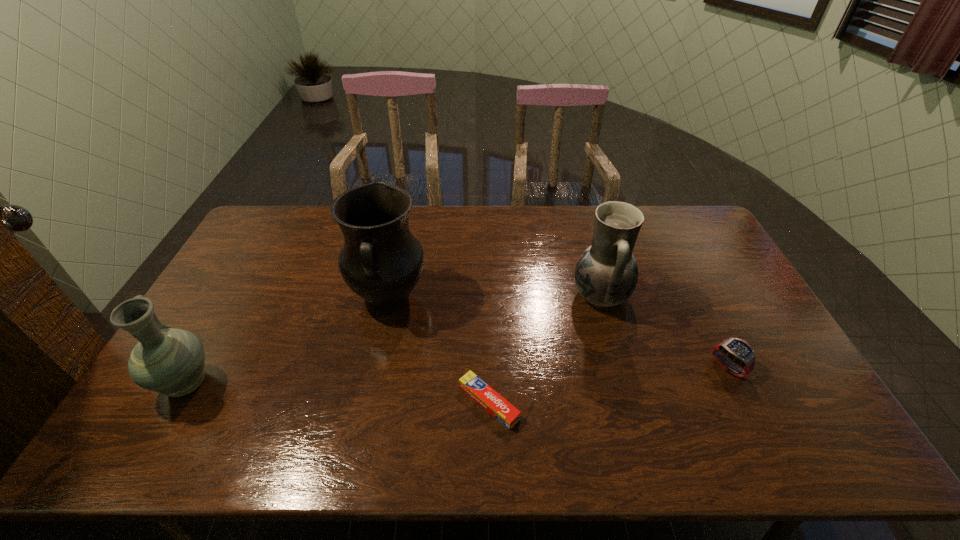
The image size is (960, 540). Find the location of `empty space between the nearest pitcher and the second pitcher from right to left`. empty space between the nearest pitcher and the second pitcher from right to left is located at coordinates (288, 341).

You are a GUI agent. You are given a task and a screenshot of the screen. Output one action in this format:
    pyautogui.click(x=<x>, y=<y>)
    Task: Click on the vacant area between the rightmost object and the fourth object from right to left
    This screenshot has height=540, width=960.
    Given the screenshot: What is the action you would take?
    pyautogui.click(x=558, y=332)

The height and width of the screenshot is (540, 960). I want to click on free area in between the fourth object from right to left and the leftmost pitcher, so click(288, 341).

Locate an element on the screen. vacant area that lies between the second object from left to right and the leftmost pitcher is located at coordinates (288, 341).

The width and height of the screenshot is (960, 540). What are the coordinates of `empty location between the second object from right to left and the rightmost object` in the screenshot? It's located at (664, 331).

Where is `vacant area that lies between the rightmost object and the shortest object`? This screenshot has width=960, height=540. vacant area that lies between the rightmost object and the shortest object is located at coordinates (609, 384).

At what (x,y) coordinates should I click in order to perform the action: click on the second closest object to the leftmost pitcher. Please return your answer as a coordinate pair (x, y). Looking at the image, I should click on (487, 397).

The width and height of the screenshot is (960, 540). In order to click on object that is the closest one to the second object from left to right in this screenshot , I will do `click(487, 397)`.

You are a GUI agent. You are given a task and a screenshot of the screen. Output one action in this format:
    pyautogui.click(x=<x>, y=<y>)
    Task: Click on the pitcher that stands as the second closest to the fourth object from right to left
    The width and height of the screenshot is (960, 540).
    Given the screenshot: What is the action you would take?
    point(606,274)

Locate which pitcher is the closest to the fourth object from right to left. Please provide its 2D coordinates. Your answer should be formatted as a tuple, i.e. [(x, y)], where the tuple contains the x and y coordinates of a point satisfying the conditions above.

[(170, 361)]